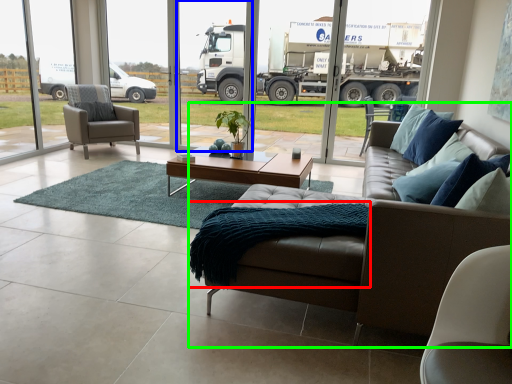
Question: Based on their relative distances, which object is nearer to blanket (highlighted by a red box)? Choose from screen door (highlighted by a blue box) and studio couch (highlighted by a green box).

Choices:
 (A) screen door
 (B) studio couch

Answer: (B)